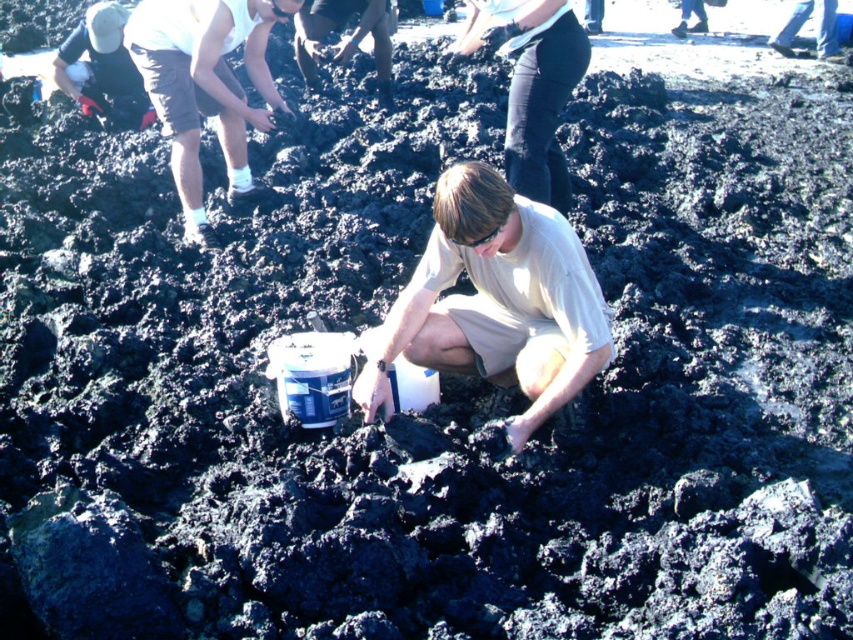
You are a fashion designer observing the scene. You need to determine which clothing item, the dark blue jeans at center or the matte black shirt at upper left, requires more fabric to produce. Based on the size difference visible in the image, which one would you choose?

The dark blue jeans at center has a larger size compared to matte black shirt at upper left, so it requires more fabric to produce.

You are standing in the scene and want to place a small flag between the dark blue jeans at center and the matte black shirt at upper left. According to their positions, where should you place the flag?

The dark blue jeans at center is positioned under the matte black shirt at upper left, so you should place the flag between them, below the matte black shirt at upper left and above the dark blue jeans at center.